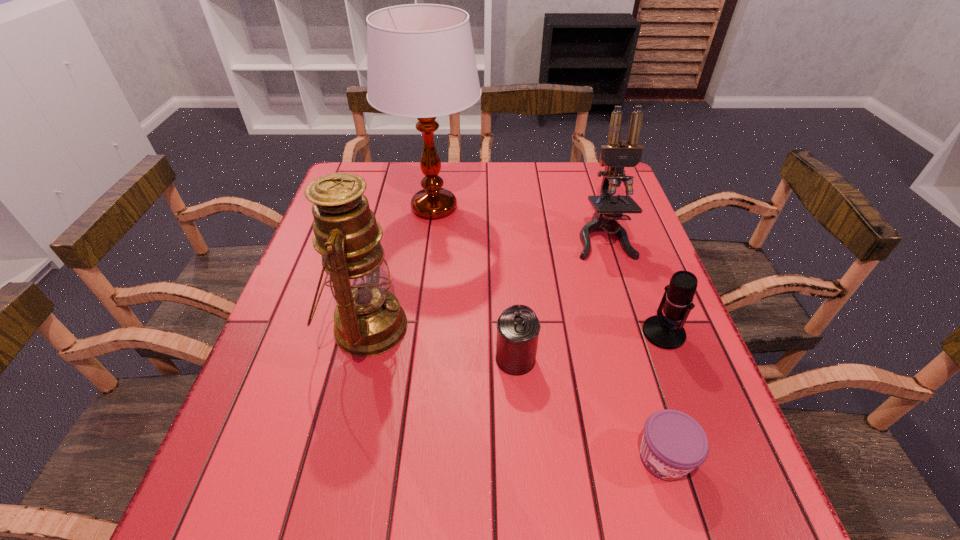
Locate an element on the screen. This screenshot has width=960, height=540. free location located at the eyepieces of the microscope is located at coordinates (627, 313).

Image resolution: width=960 pixels, height=540 pixels. In order to click on free spot located on the left of the third shortest object in this screenshot , I will do `click(551, 333)`.

Locate an element on the screen. The width and height of the screenshot is (960, 540). vacant space located on the front of the third object from left to right is located at coordinates (520, 428).

Where is `free spot located 0.060m on the front label of the nearest object`? free spot located 0.060m on the front label of the nearest object is located at coordinates (684, 529).

Locate an element on the screen. object located in the far edge section of the desktop is located at coordinates (421, 64).

Find the location of a particular element. object present at the near edge is located at coordinates (673, 444).

This screenshot has width=960, height=540. In order to click on object that is at the left edge in this screenshot , I will do `click(369, 320)`.

Where is `microscope situated at the right edge`? microscope situated at the right edge is located at coordinates (616, 155).

At what (x,y) coordinates should I click in order to perform the action: click on microphone located in the right edge section of the desktop. Please return your answer as a coordinate pair (x, y). This screenshot has width=960, height=540. Looking at the image, I should click on (665, 332).

Locate an element on the screen. Image resolution: width=960 pixels, height=540 pixels. jam positioned at the right edge is located at coordinates (673, 444).